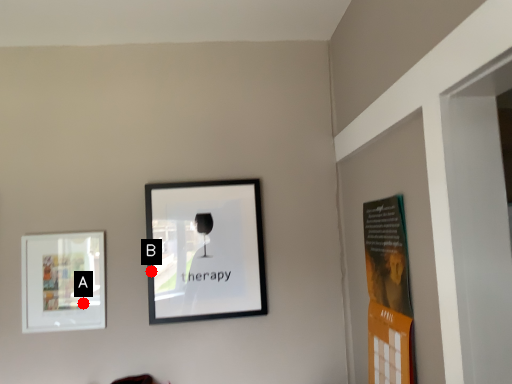
Question: Two points are circled on the image, labeled by A and B beside each circle. Among these points, which one is nearest to the camera?

Choices:
 (A) A is closer
 (B) B is closer

Answer: (A)